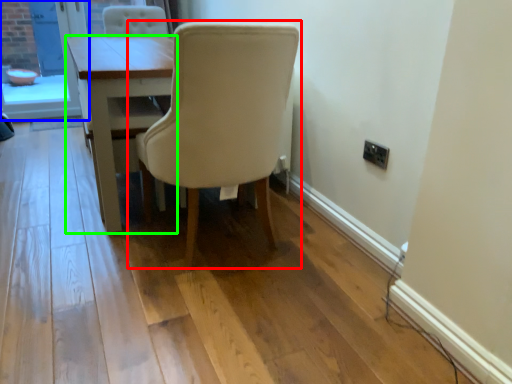
Question: Estimate the real-world distances between objects in this image. Which object is closer to chair (highlighted by a red box), screen door (highlighted by a blue box) or table (highlighted by a green box)?

Choices:
 (A) screen door
 (B) table

Answer: (B)